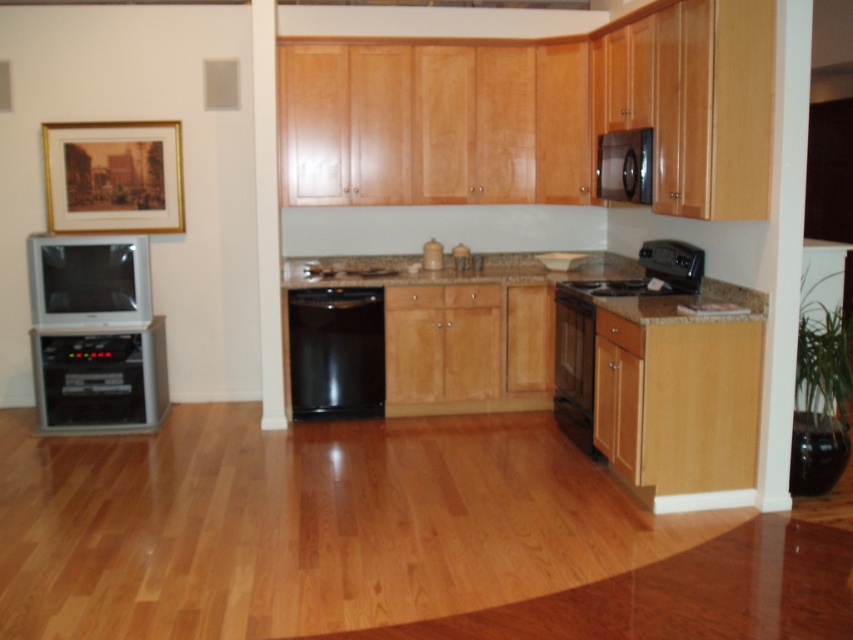
Question: Which object is closer to the camera taking this photo?

Choices:
 (A) black glossy stove at center
 (B) black glossy dishwasher at center
 (C) granite/stone countertop at center

Answer: (A)

Question: Estimate the real-world distances between objects in this image. Which object is farther from the black glass oven at lower center?

Choices:
 (A) matte silver television at left
 (B) black glossy stove at center
 (C) black glossy dishwasher at center
 (D) granite/stone countertop at center

Answer: (A)

Question: Estimate the real-world distances between objects in this image. Which object is closer to the metallic silver stereo at left?

Choices:
 (A) black glossy dishwasher at center
 (B) black glossy stove at center
 (C) matte silver television at left

Answer: (C)

Question: Is matte silver television at left positioned in front of black glass oven at lower center?

Choices:
 (A) no
 (B) yes

Answer: (A)

Question: From the image, what is the correct spatial relationship of black glossy dishwasher at center in relation to granite/stone countertop at center?

Choices:
 (A) below
 (B) above

Answer: (A)

Question: Can you confirm if matte silver television at left is thinner than black glass oven at lower center?

Choices:
 (A) no
 (B) yes

Answer: (A)